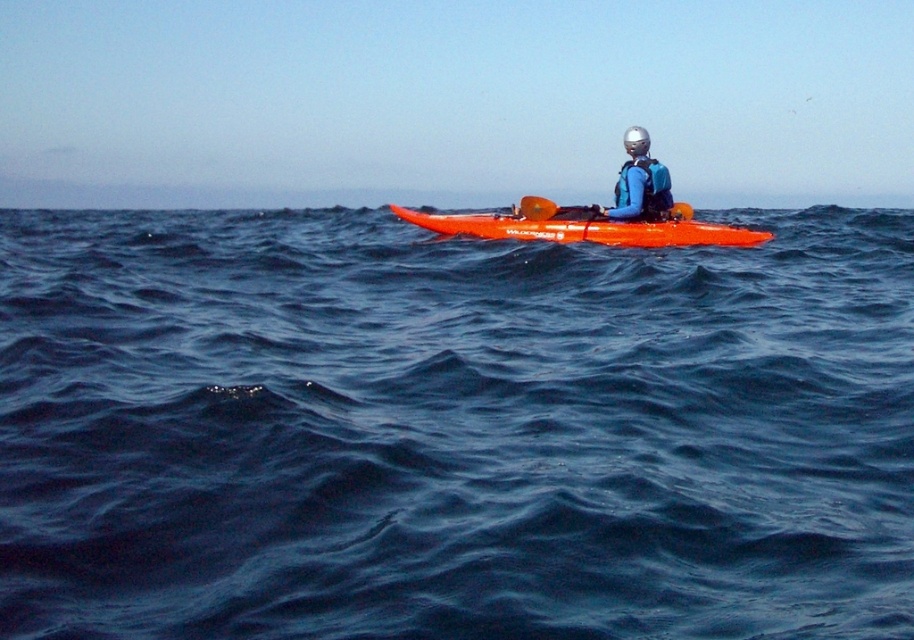
Question: Does orange plastic kayak at center appear over blue synthetic life jacket at center?

Choices:
 (A) yes
 (B) no

Answer: (B)

Question: Which point appears farthest from the camera in this image?

Choices:
 (A) (646, 216)
 (B) (626, 134)

Answer: (A)

Question: Which of the following is the closest to the observer?

Choices:
 (A) (638, 156)
 (B) (519, 204)
 (C) (551, 240)
 (D) (646, 166)

Answer: (A)

Question: Which of the following is the farthest from the observer?

Choices:
 (A) orange plastic kayak at center
 (B) orange rubber paddle at center
 (C) blue matte wetsuit at center

Answer: (A)

Question: Can you confirm if blue water at center is positioned above silver metallic helmet at upper center?

Choices:
 (A) yes
 (B) no

Answer: (B)

Question: From the image, what is the correct spatial relationship of blue water at center in relation to orange rubber paddle at center?

Choices:
 (A) above
 (B) below

Answer: (B)